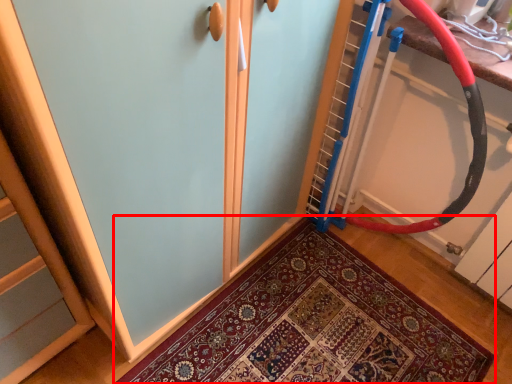
Question: From the image, what is the correct spatial relationship of mat (annotated by the red box) in relation to garden hose?

Choices:
 (A) left
 (B) right

Answer: (A)